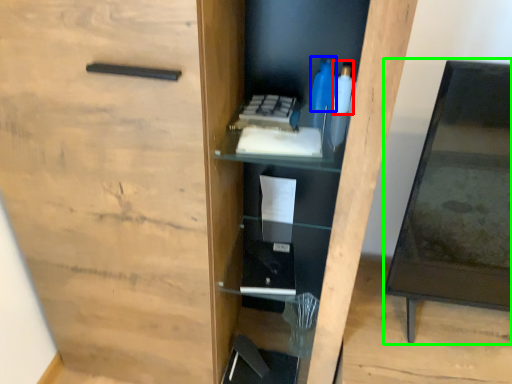
Question: Which object is the closest to the bottle (highlighted by a red box)? Choose among these: bottle (highlighted by a blue box) or table (highlighted by a green box).

Choices:
 (A) bottle
 (B) table

Answer: (A)